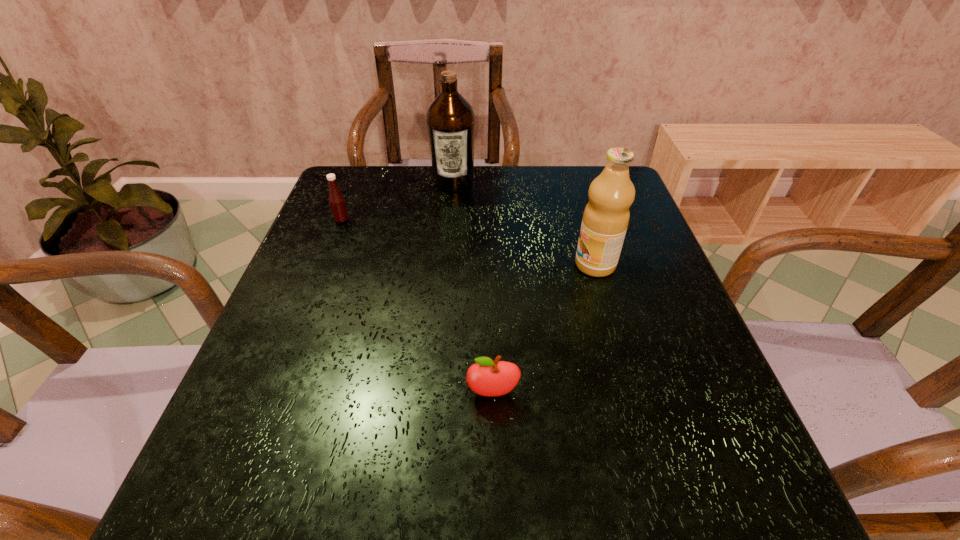
The width and height of the screenshot is (960, 540). What are the coordinates of `the farthest object` in the screenshot? It's located at (450, 120).

Find the location of a particular element. The image size is (960, 540). the left olive oil is located at coordinates (450, 120).

Locate an element on the screen. This screenshot has width=960, height=540. the nearer olive oil is located at coordinates (606, 216).

What are the coordinates of `the right olive oil` in the screenshot? It's located at (606, 216).

Find the location of a particular element. The height and width of the screenshot is (540, 960). Tabasco sauce is located at coordinates (337, 202).

The width and height of the screenshot is (960, 540). I want to click on the second shortest object, so click(337, 202).

At what (x,y) coordinates should I click in order to perform the action: click on the shortest object. Please return your answer as a coordinate pair (x, y). Looking at the image, I should click on (486, 377).

Find the location of a particular element. This screenshot has width=960, height=540. apple is located at coordinates (486, 377).

Image resolution: width=960 pixels, height=540 pixels. I want to click on vacant space located 0.120m on the label of the left olive oil, so click(450, 220).

You are a GUI agent. You are given a task and a screenshot of the screen. Output one action in this format:
    pyautogui.click(x=<x>, y=<y>)
    Task: Click on the free space located on the label of the nearer olive oil
    The image size is (960, 540).
    Given the screenshot: What is the action you would take?
    pyautogui.click(x=552, y=265)